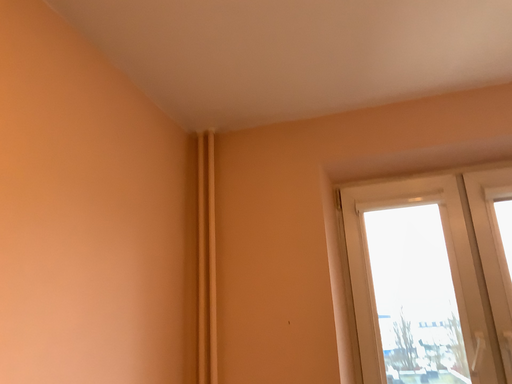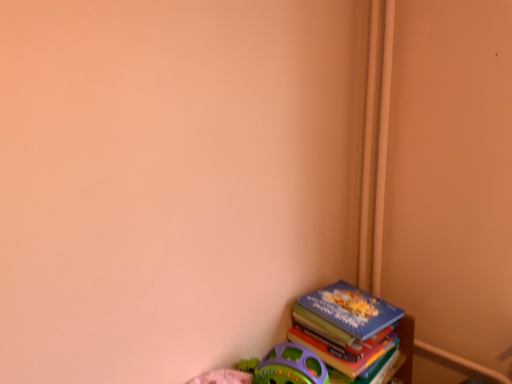
Question: Which way did the camera rotate in the video?

Choices:
 (A) rotated upward
 (B) rotated downward

Answer: (B)